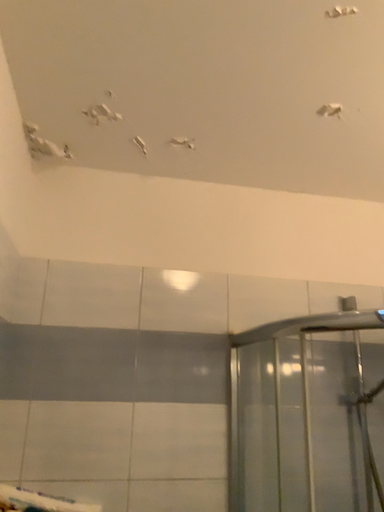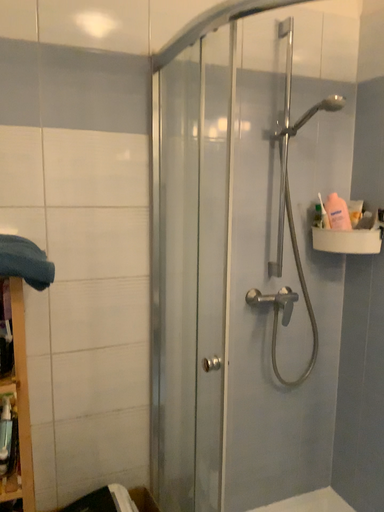
Question: How did the camera likely rotate when shooting the video?

Choices:
 (A) rotated left
 (B) rotated right

Answer: (B)